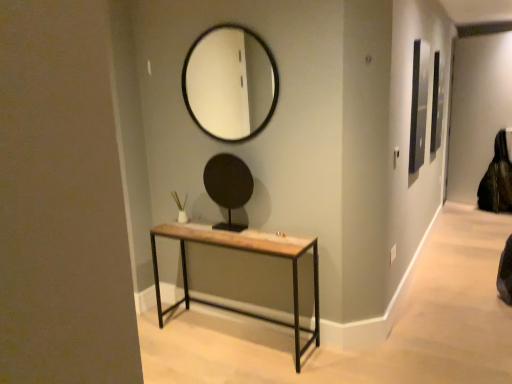
Question: Is black glass mirror at upper center, the first mirror from the top, taller than rustic wood table at center?

Choices:
 (A) no
 (B) yes

Answer: (B)

Question: Could rustic wood table at center be considered to be inside black glass mirror at upper center, the first mirror from the top?

Choices:
 (A) yes
 (B) no

Answer: (B)

Question: Is black glass mirror at upper center, which appears as the 2th mirror when ordered from the bottom, not inside rustic wood table at center?

Choices:
 (A) yes
 (B) no

Answer: (A)

Question: Is black glass mirror at upper center, which appears as the 2th mirror when ordered from the bottom, far from rustic wood table at center?

Choices:
 (A) no
 (B) yes

Answer: (B)

Question: Does black glass mirror at upper center, the first mirror from the top, have a larger size compared to rustic wood table at center?

Choices:
 (A) no
 (B) yes

Answer: (A)

Question: Is black leather swivel chair at right taller or shorter than black matte mirror at center, marked as the first mirror in a bottom-to-top arrangement?

Choices:
 (A) tall
 (B) short

Answer: (A)

Question: In the image, is black leather swivel chair at right positioned in front of or behind black matte mirror at center, which appears as the 2th mirror when viewed from the top?

Choices:
 (A) front
 (B) behind

Answer: (B)

Question: In the image, is black leather swivel chair at right on the left side or the right side of black matte mirror at center, which appears as the 2th mirror when viewed from the top?

Choices:
 (A) right
 (B) left

Answer: (A)

Question: Is black leather swivel chair at right bigger or smaller than black matte mirror at center, which appears as the 2th mirror when viewed from the top?

Choices:
 (A) small
 (B) big

Answer: (B)

Question: From the image's perspective, is black matte mirror at center, marked as the first mirror in a bottom-to-top arrangement, located above or below rustic wood table at center?

Choices:
 (A) above
 (B) below

Answer: (A)

Question: Considering the positions of point (220, 180) and point (272, 244), is point (220, 180) closer or farther from the camera than point (272, 244)?

Choices:
 (A) closer
 (B) farther

Answer: (B)

Question: From a real-world perspective, is black matte mirror at center, marked as the first mirror in a bottom-to-top arrangement, positioned above or below rustic wood table at center?

Choices:
 (A) below
 (B) above

Answer: (B)

Question: Visually, is black matte mirror at center, which appears as the 2th mirror when viewed from the top, positioned to the left or to the right of rustic wood table at center?

Choices:
 (A) right
 (B) left

Answer: (B)

Question: From the image's perspective, is black leather swivel chair at right located above or below rustic wood table at center?

Choices:
 (A) below
 (B) above

Answer: (B)

Question: Is point click(478, 205) positioned closer to the camera than point click(269, 253)?

Choices:
 (A) farther
 (B) closer

Answer: (A)